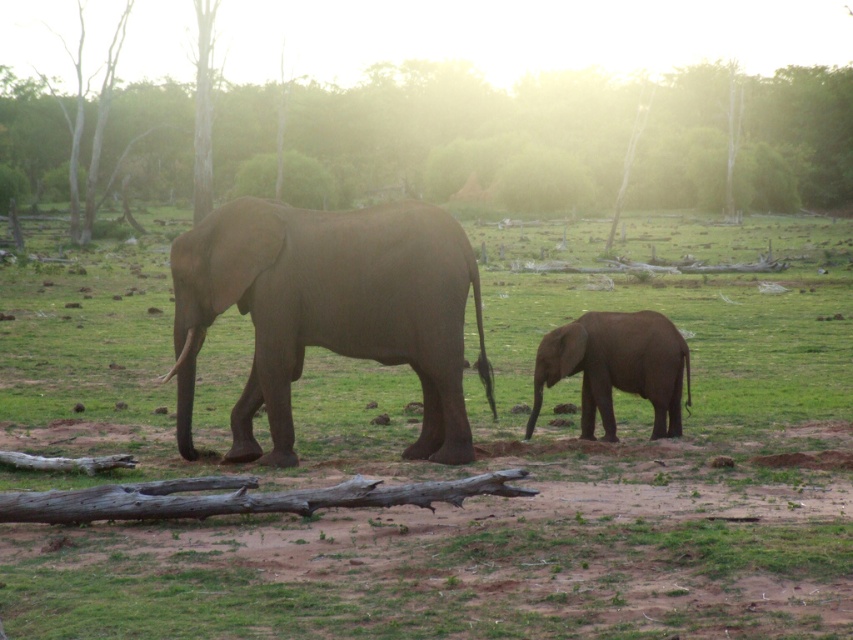
You are standing in the natural setting shown in the image. You see the gray matte elephant at center and the gray matte elephant at lower right. Which elephant is positioned closer to your right side?

The gray matte elephant at lower right is positioned closer to your right side because it is located to the right of the gray matte elephant at center.

You are an observer standing in front of the two gray matte elephants. Which one is closer to you, the gray matte elephant at center or the gray matte elephant at lower right?

The gray matte elephant at center is closer to you because it is positioned in front of the gray matte elephant at lower right.

You are an observer standing in front of the image. You notice the brown textured tree at upper center and the gray matte elephant at center. Which object is larger in size?

The brown textured tree at upper center is bigger than the gray matte elephant at center according to the description.